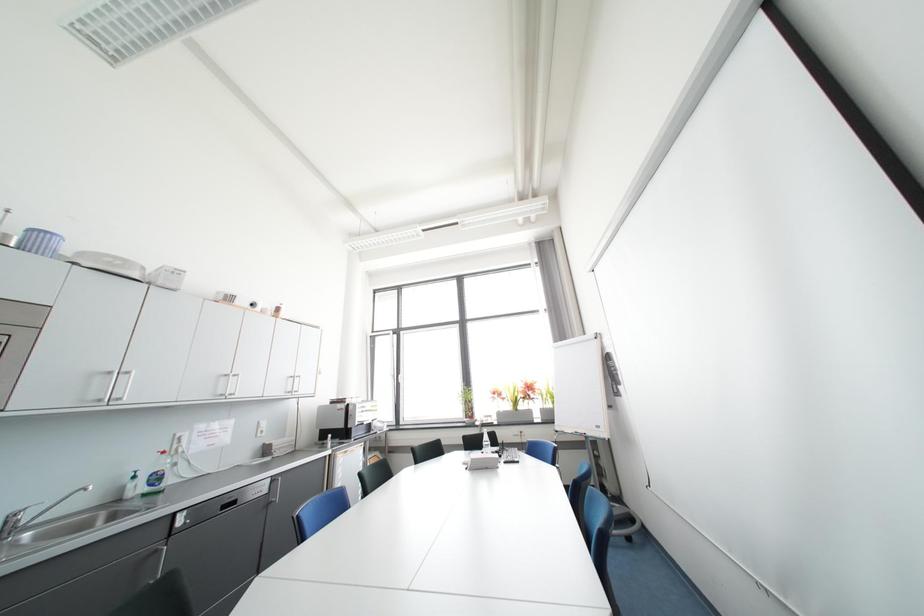
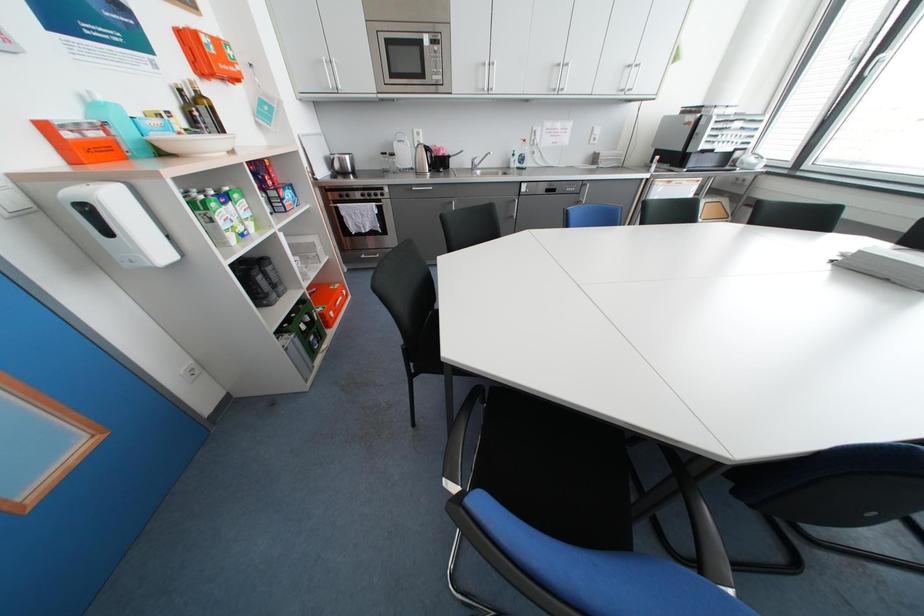
How did the camera likely rotate?

The camera's rotation is toward left-down.